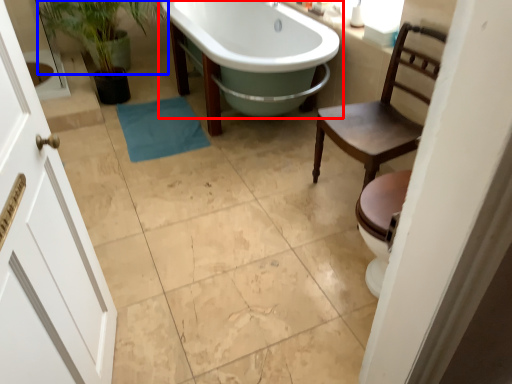
Question: Which of the following is the closest to the observer, bathtub (highlighted by a red box) or plant (highlighted by a blue box)?

Choices:
 (A) bathtub
 (B) plant

Answer: (A)